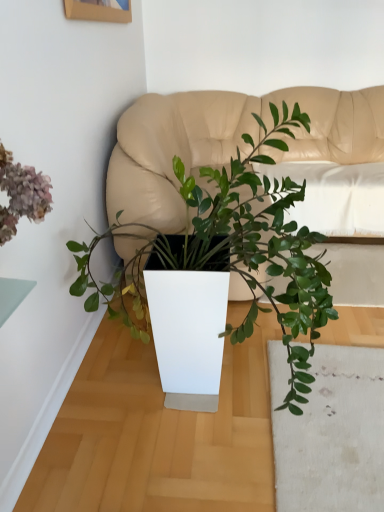
Question: Is there a large distance between matte beige couch at center and green matte plant at center?

Choices:
 (A) yes
 (B) no

Answer: (B)

Question: Does matte beige couch at center appear on the left side of green matte plant at center?

Choices:
 (A) no
 (B) yes

Answer: (A)

Question: Is the depth of matte beige couch at center less than that of green matte plant at center?

Choices:
 (A) yes
 (B) no

Answer: (B)

Question: Can you confirm if matte beige couch at center is taller than green matte plant at center?

Choices:
 (A) no
 (B) yes

Answer: (A)

Question: Does matte beige couch at center come behind green matte plant at center?

Choices:
 (A) no
 (B) yes

Answer: (B)

Question: Can you see matte beige couch at center touching green matte plant at center?

Choices:
 (A) yes
 (B) no

Answer: (B)

Question: Considering the relative sizes of green matte plant at center and matte beige couch at center in the image provided, is green matte plant at center wider than matte beige couch at center?

Choices:
 (A) yes
 (B) no

Answer: (B)

Question: Is green matte plant at center shorter than matte beige couch at center?

Choices:
 (A) no
 (B) yes

Answer: (A)

Question: Does green matte plant at center touch matte beige couch at center?

Choices:
 (A) no
 (B) yes

Answer: (A)

Question: From a real-world perspective, is green matte plant at center below matte beige couch at center?

Choices:
 (A) no
 (B) yes

Answer: (A)

Question: Does green matte plant at center come behind matte beige couch at center?

Choices:
 (A) no
 (B) yes

Answer: (A)

Question: Is green matte plant at center looking in the opposite direction of matte beige couch at center?

Choices:
 (A) yes
 (B) no

Answer: (B)

Question: Which is correct: matte beige couch at center is inside green matte plant at center, or outside of it?

Choices:
 (A) outside
 (B) inside

Answer: (A)